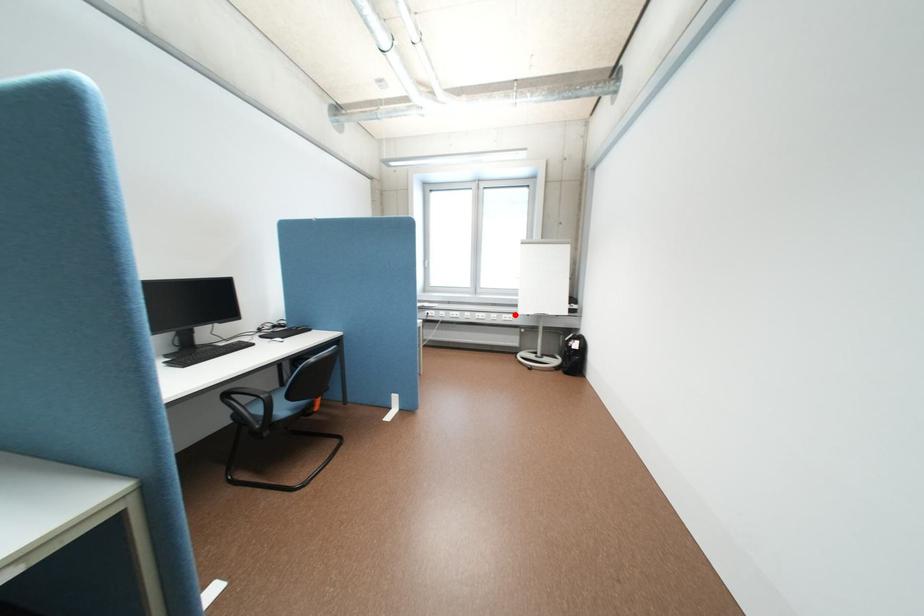
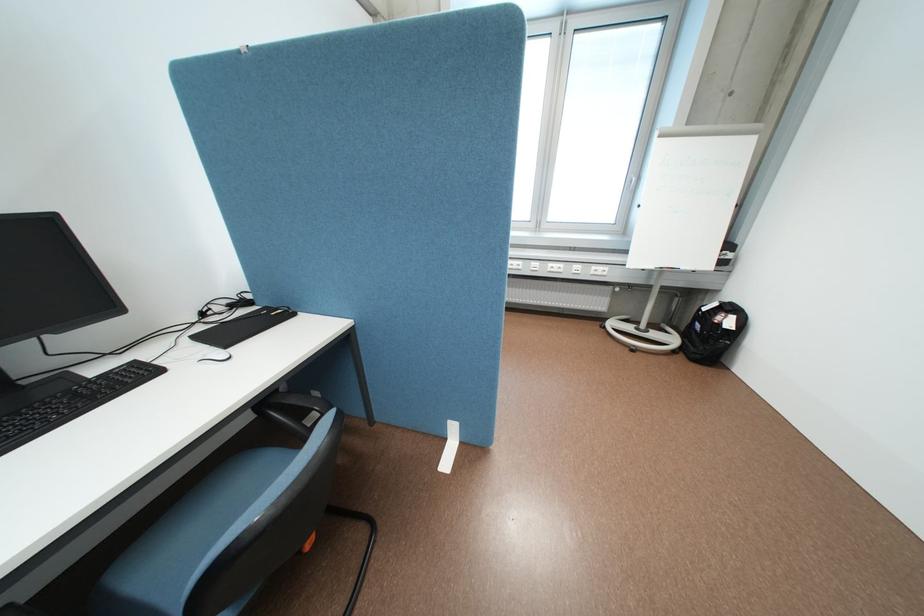
The point at the highlighted location is marked in the first image. Where is the corresponding point in the second image?

(604, 267)